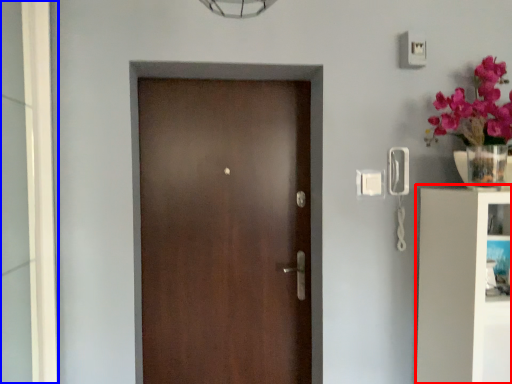
Question: Which of the following is the farthest to the observer, bookshelf (highlighted by a red box) or glass door (highlighted by a blue box)?

Choices:
 (A) bookshelf
 (B) glass door

Answer: (A)